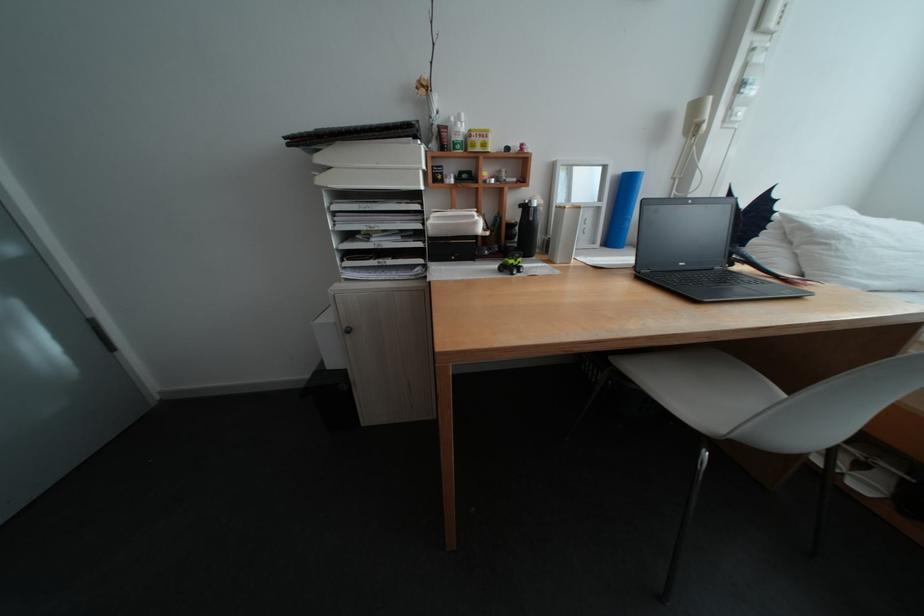
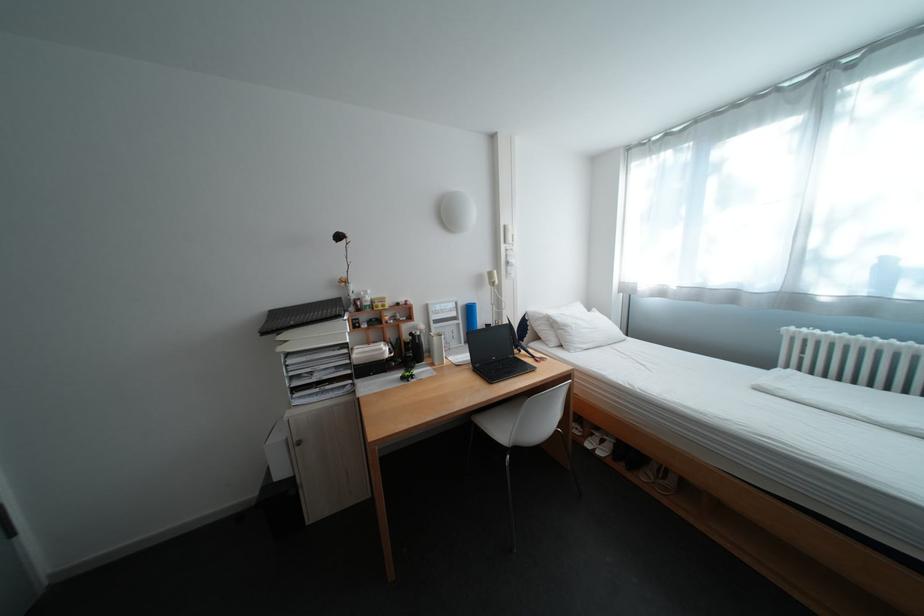
Question: In a continuous first-person perspective shot, in which direction is the camera moving?

Choices:
 (A) Left
 (B) Right
 (C) Forward
 (D) Backward

Answer: (D)